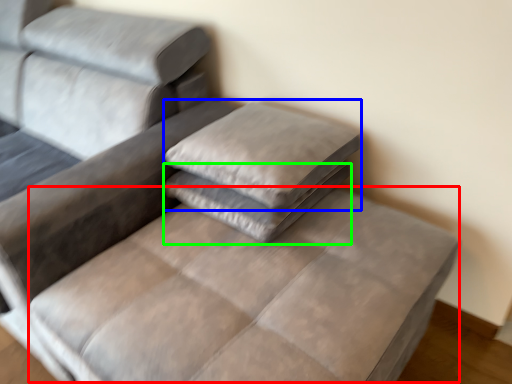
Question: Which object is positioned closest to mattress (highlighted by a red box)? Select from pillow (highlighted by a blue box) and pillow (highlighted by a green box).

Choices:
 (A) pillow
 (B) pillow

Answer: (B)